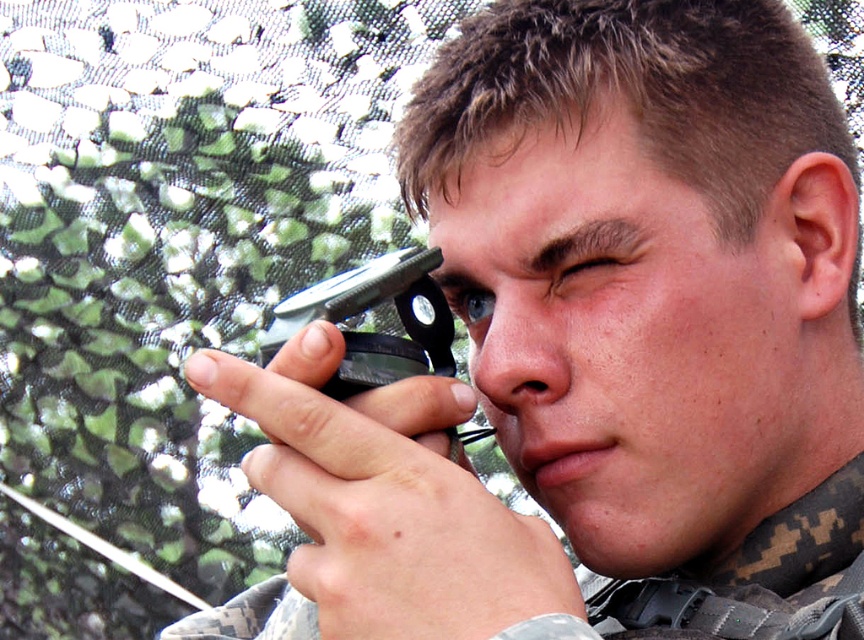
You are a field medic assessing a soldier in a tactical scenario. You notice the camouflage fabric at center and the pinkish skin ear at right. Which object is wider?

The camouflage fabric at center is wider than the pinkish skin ear at right.

You are a field medic assessing a soldier in a tactical scenario. You notice the camouflage fabric at center and the pinkish skin ear at right. Which object is larger in size?

The camouflage fabric at center is bigger than the pinkish skin ear at right.

You are a field medic assessing an injured soldier in the scene. The soldier is wearing camouflage fabric at center and has a pinkish skin ear at right. Based on the spatial relationship between these two objects, can you determine if the camouflage fabric is positioned above or below the ear?

The camouflage fabric at center is taller than the pinkish skin ear at right, meaning it is positioned above the ear.